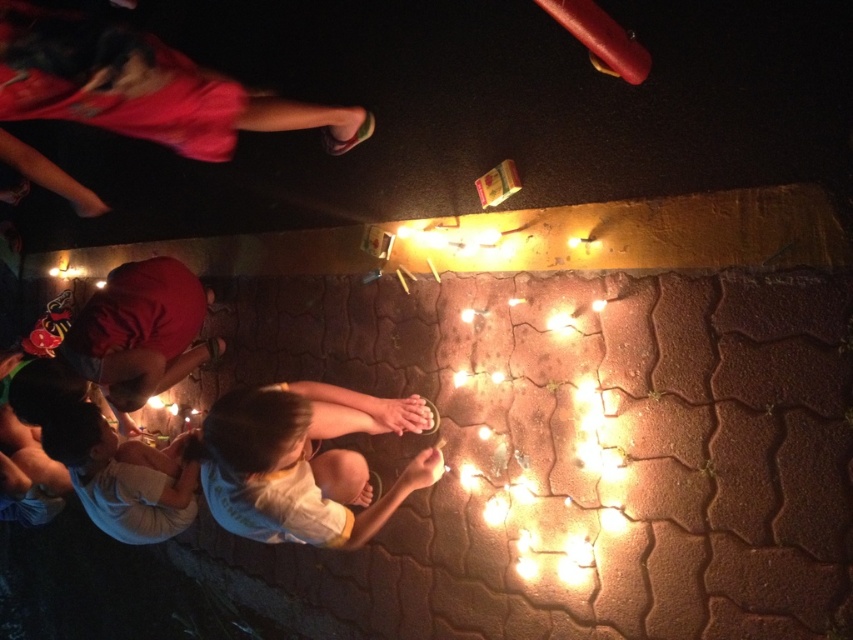
You are a photographer trying to capture the heart shape formed by the lights in the nighttime scene. You notice a matte red shirt at lower left at point (140, 332). Will this object block your view of the heart shape?

The matte red shirt at lower left at point (140, 332) is located at the lower left, so it might block the view of the heart shape formed by the lights depending on the camera angle and positioning.

You are a photographer trying to capture a closeup shot of the two children in the scene. You notice the matte red shirt at lower left and the white cotton shirt at lower left. Which child should you focus on if you want to photograph the one wearing the shirt that is more to the left?

The matte red shirt at lower left is positioned on the left side of white cotton shirt at lower left, so focusing on the child wearing the matte red shirt at lower left will capture the one more to the left.